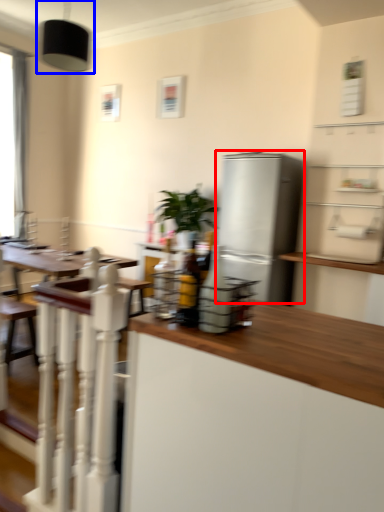
Question: Which point is further to the camera, refrigerator (highlighted by a red box) or light fixture (highlighted by a blue box)?

Choices:
 (A) refrigerator
 (B) light fixture

Answer: (A)